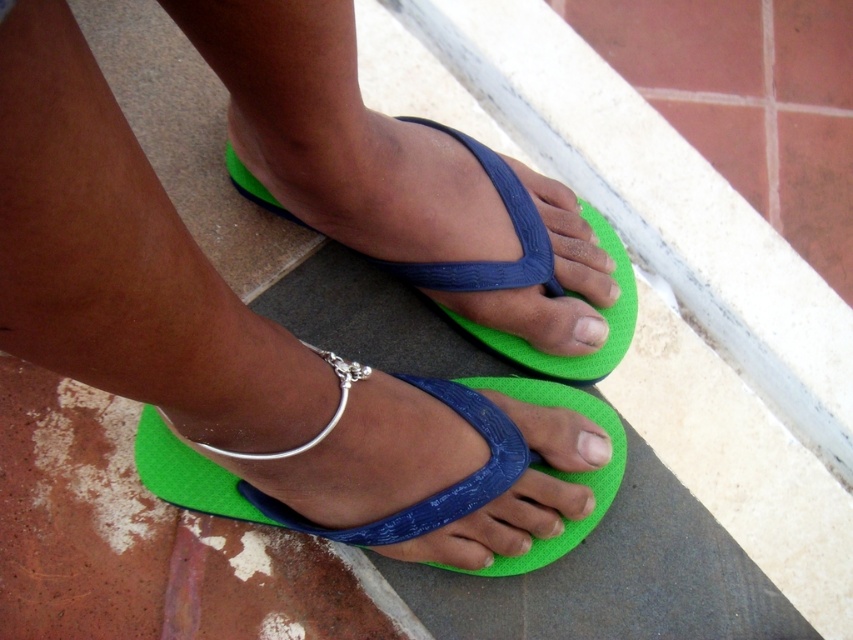
Consider the image. Who is positioned more to the right, green rubber flip-flops at center or matte blue toe at center?

matte blue toe at center is more to the right.

I want to click on green rubber flip-flops at center, so click(x=244, y=344).

Looking at this image, who is positioned more to the left, green rubber flip-flops at center or silver metallic bracelet at center?

silver metallic bracelet at center is more to the left.

Looking at this image, between green rubber flip-flops at center and silver metallic bracelet at center, which one is positioned higher?

green rubber flip-flops at center is higher up.

Who is more distant from viewer, (432, 252) or (358, 372)?

The point (432, 252) is behind.

This screenshot has width=853, height=640. Find the location of `green rubber flip-flops at center`. green rubber flip-flops at center is located at coordinates (244, 344).

Is silver metallic anklet at center taller than matte blue toe at center?

Indeed, silver metallic anklet at center has a greater height compared to matte blue toe at center.

Does silver metallic anklet at center appear on the left side of matte blue toe at center?

Yes, silver metallic anklet at center is to the left of matte blue toe at center.

This screenshot has height=640, width=853. Describe the element at coordinates (358, 451) in the screenshot. I see `silver metallic anklet at center` at that location.

Where is `silver metallic anklet at center`? The width and height of the screenshot is (853, 640). silver metallic anklet at center is located at coordinates 358,451.